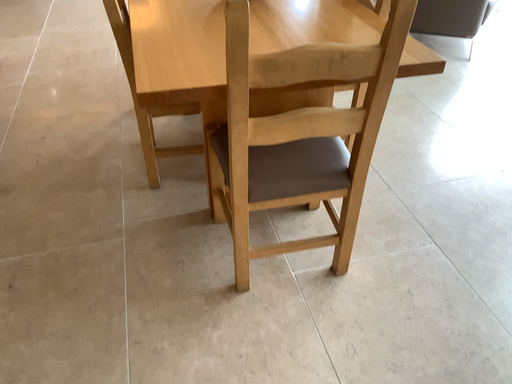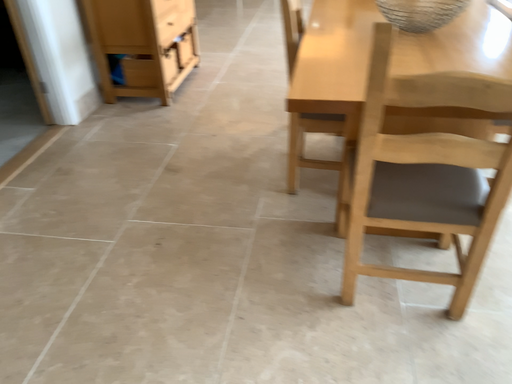
Question: How did the camera likely rotate when shooting the video?

Choices:
 (A) rotated left
 (B) rotated right

Answer: (A)